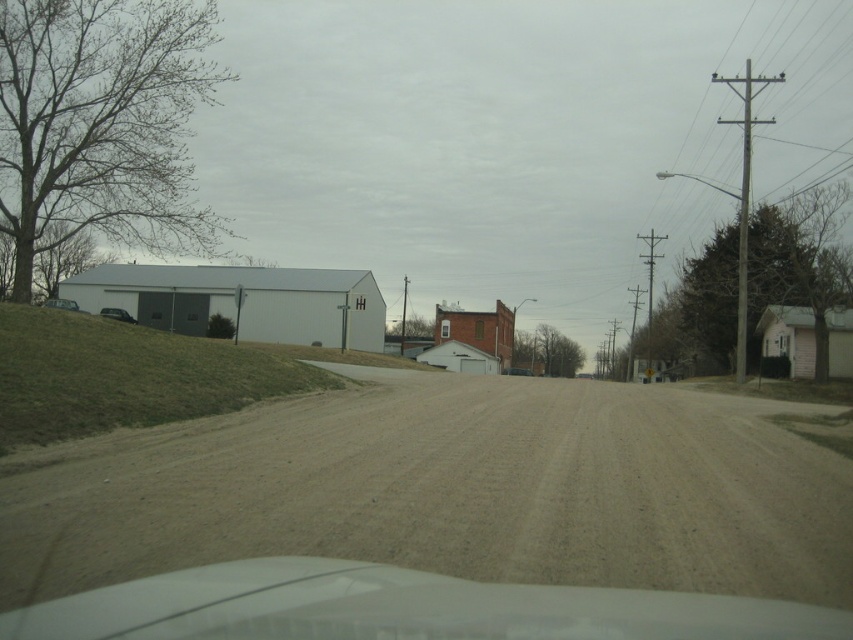
Question: Can you confirm if green grassy hill at left is positioned to the left of matte gray car at left?

Choices:
 (A) yes
 (B) no

Answer: (B)

Question: Is brown sandy dirt track at center behind matte gray car at left?

Choices:
 (A) no
 (B) yes

Answer: (A)

Question: Does brown sandy dirt track at center have a smaller size compared to green grassy hill at left?

Choices:
 (A) yes
 (B) no

Answer: (A)

Question: Among these points, which one is farthest from the camera?

Choices:
 (A) (173, 336)
 (B) (125, 310)

Answer: (B)

Question: Which point is closer to the camera?

Choices:
 (A) (71, 404)
 (B) (135, 321)

Answer: (A)

Question: Which of these objects is positioned closest to the matte gray car at left?

Choices:
 (A) matte black car at left
 (B) green grassy hill at left

Answer: (A)